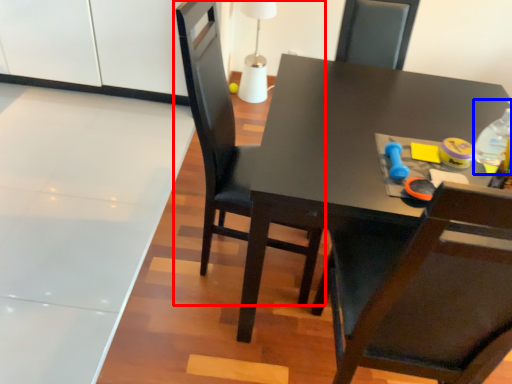
Question: Which object is closer to the camera taking this photo, chair (highlighted by a red box) or bottle (highlighted by a blue box)?

Choices:
 (A) chair
 (B) bottle

Answer: (A)